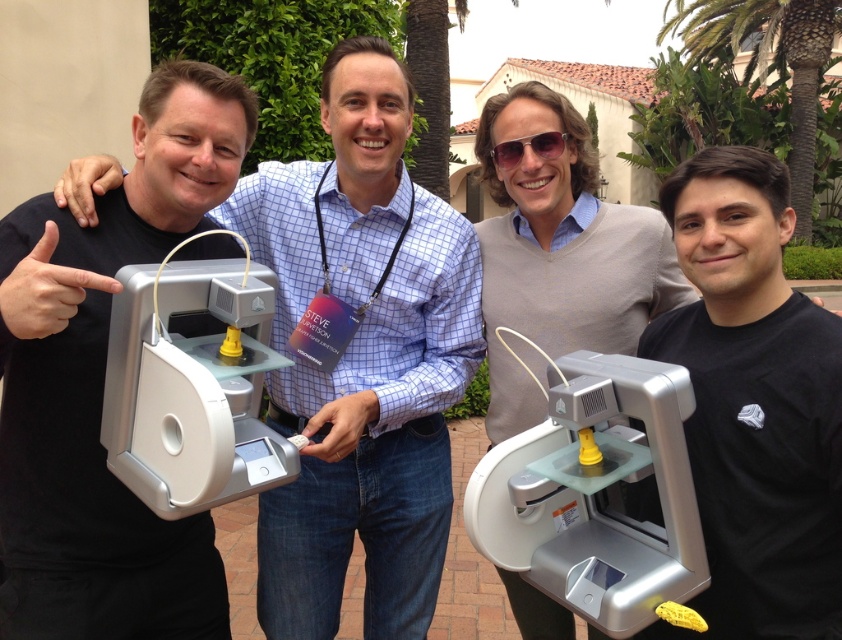
Question: Which of the following is the farthest from the observer?

Choices:
 (A) (814, 124)
 (B) (313, 557)
 (C) (530, 564)

Answer: (A)

Question: Is the position of matte black printer at left less distant than that of green leafy palm tree at upper right?

Choices:
 (A) yes
 (B) no

Answer: (A)

Question: Can you confirm if silver metallic 3d printer at center is positioned to the right of silver metallic 3d printer at left?

Choices:
 (A) no
 (B) yes

Answer: (B)

Question: Which of these objects is positioned farthest from the matte gray printer at center?

Choices:
 (A) shiny black sunglasses at center
 (B) silver metallic 3d printer at left

Answer: (A)

Question: Does matte silver printer at center appear on the left side of shiny black sunglasses at center?

Choices:
 (A) yes
 (B) no

Answer: (A)

Question: Which of these objects is positioned farthest from the matte black printer at left?

Choices:
 (A) shiny black sunglasses at center
 (B) matte gray printer at center

Answer: (B)